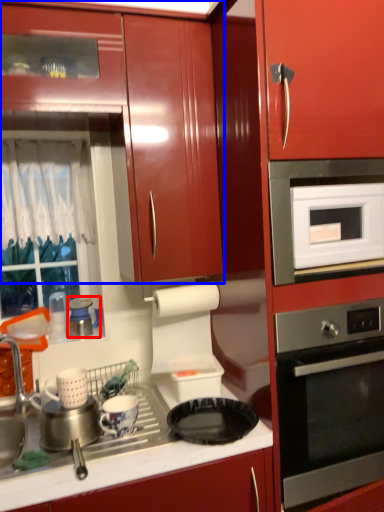
Question: Which object is closer to the camera taking this photo, appliance (highlighted by a red box) or cabinetry (highlighted by a blue box)?

Choices:
 (A) appliance
 (B) cabinetry

Answer: (B)